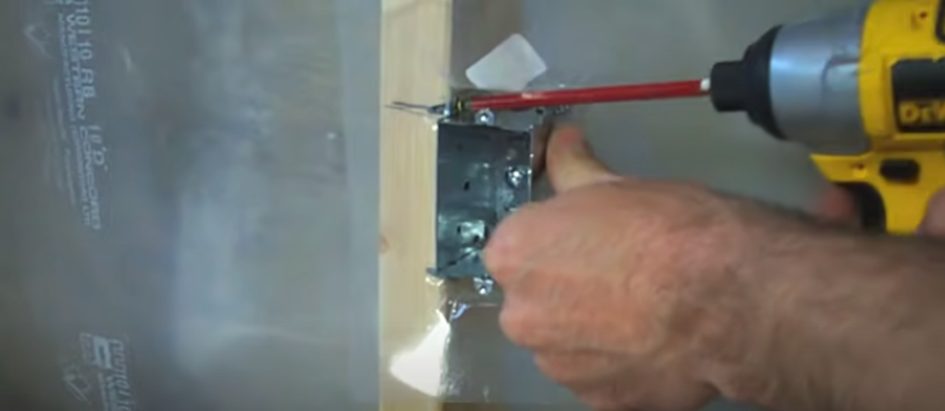
Find the location of a particular element. drywall print is located at coordinates (95, 375), (86, 97).